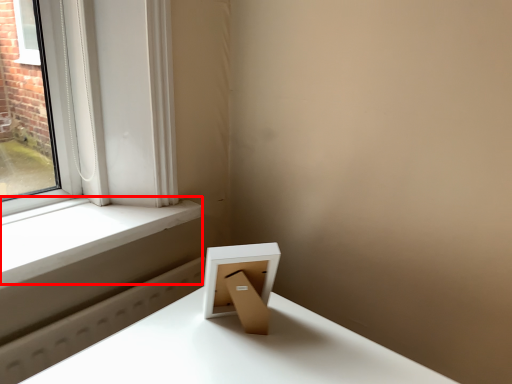
Question: Where is window sill (annotated by the red box) located in relation to picture frame in the image?

Choices:
 (A) left
 (B) right

Answer: (A)